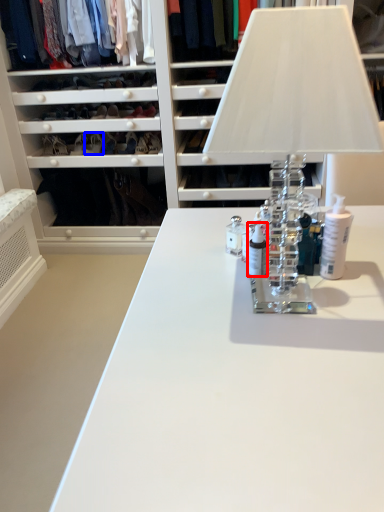
Question: Which object appears closest to the camera in this image, toiletry (highlighted by a red box) or shoe (highlighted by a blue box)?

Choices:
 (A) toiletry
 (B) shoe

Answer: (A)